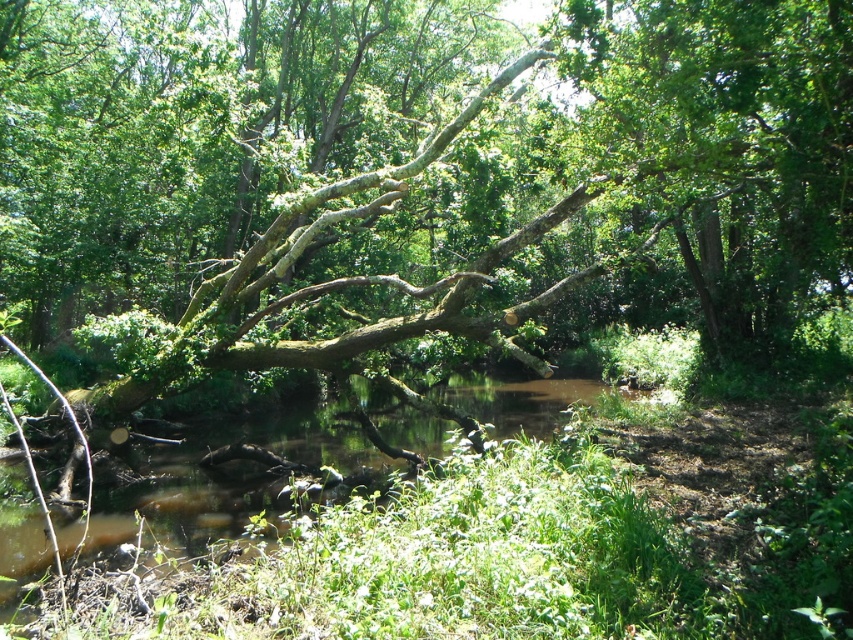
Which is below, green mossy branch at center or brown muddy water at center?

brown muddy water at center is below.

Who is positioned more to the left, green mossy branch at center or brown muddy water at center?

brown muddy water at center

Where is `green mossy branch at center`? The width and height of the screenshot is (853, 640). green mossy branch at center is located at coordinates (416, 176).

Is point (747, 108) more distant than point (355, 454)?

No.

Between point (612, 58) and point (223, 525), which one is positioned behind?

The point (223, 525) is behind.

Find the location of a particular element. This screenshot has height=640, width=853. green leafy tree at upper right is located at coordinates (730, 145).

This screenshot has height=640, width=853. I want to click on green leafy tree at upper right, so click(730, 145).

Who is more forward, [61,214] or [695,240]?

Point [61,214] is more forward.

Between green mossy branch at center and green leafy tree at upper right, which one appears on the left side from the viewer's perspective?

green mossy branch at center is more to the left.

Is point (379, 209) closer to camera compared to point (727, 166)?

No, it is behind (727, 166).

I want to click on green mossy branch at center, so click(416, 176).